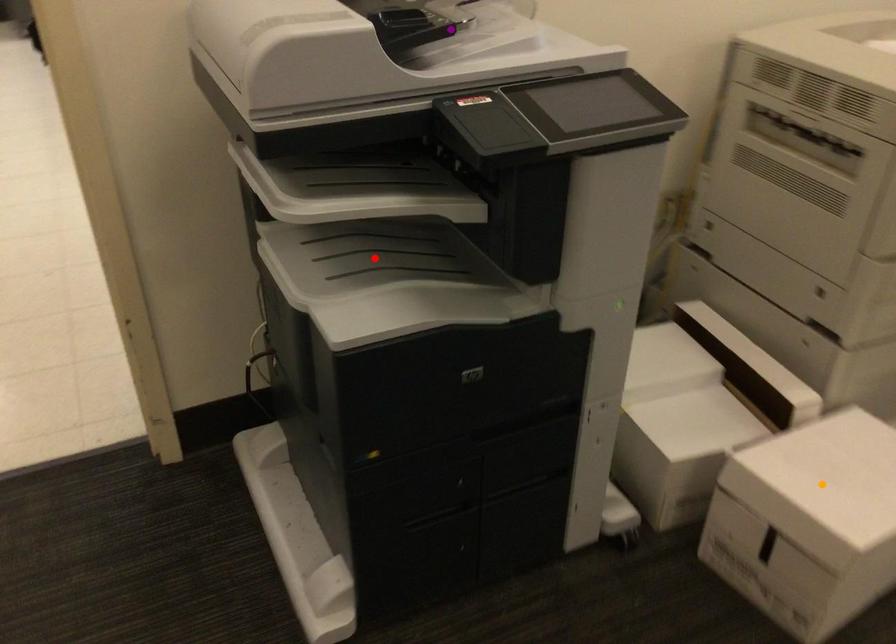
Order these from nearest to farthest:
orange point
purple point
red point

purple point
red point
orange point